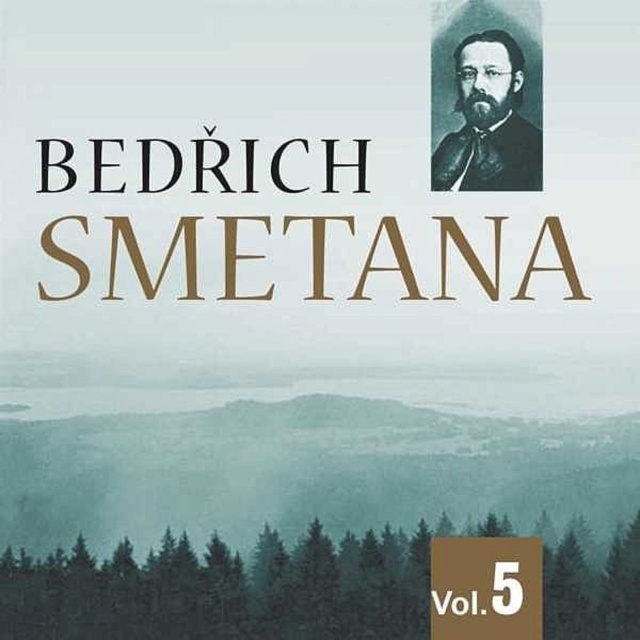
Is point (227, 262) positioned behind point (74, 164)?

No.

Find the location of a particular element. gold metallic text at center is located at coordinates (161, 259).

Does black serif text at upper center have a greater width compared to black velvet portrait at upper right?

Yes.

Between black serif text at upper center and black velvet portrait at upper right, which one appears on the right side from the viewer's perspective?

From the viewer's perspective, black velvet portrait at upper right appears more on the right side.

Is point (230, 184) closer to viewer compared to point (516, 49)?

Yes, it is.

Identify the location of black serif text at upper center. (202, 164).

Between point (250, 216) and point (483, 157), which one is positioned in front?

Positioned in front is point (250, 216).

Does gold metallic text at center have a smaller size compared to black velvet portrait at upper right?

Incorrect, gold metallic text at center is not smaller in size than black velvet portrait at upper right.

Does point (346, 225) come closer to viewer compared to point (522, 80)?

That is True.

At what (x,y) coordinates should I click in order to perform the action: click on gold metallic text at center. Please return your answer as a coordinate pair (x, y). This screenshot has width=640, height=640. Looking at the image, I should click on (161, 259).